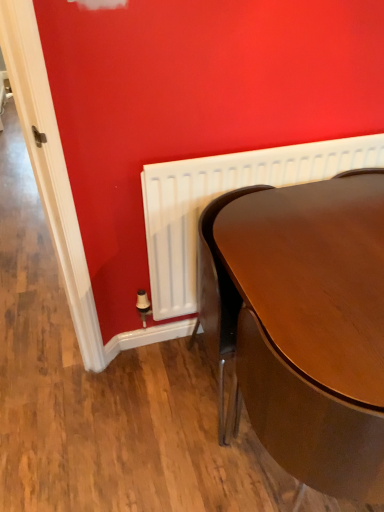
Question: From a real-world perspective, is white plastic radiator at lower left above or below glossy wood table at right?

Choices:
 (A) below
 (B) above

Answer: (B)

Question: Is point (160, 270) closer or farther from the camera than point (314, 426)?

Choices:
 (A) farther
 (B) closer

Answer: (A)

Question: From the image's perspective, is white plastic radiator at lower left located above or below glossy wood table at right?

Choices:
 (A) below
 (B) above

Answer: (B)

Question: Would you say glossy wood table at right is to the left or to the right of white plastic radiator at lower left in the picture?

Choices:
 (A) left
 (B) right

Answer: (B)

Question: Looking at the image, does glossy wood table at right seem bigger or smaller compared to white plastic radiator at lower left?

Choices:
 (A) big
 (B) small

Answer: (A)

Question: From their relative heights in the image, would you say glossy wood table at right is taller or shorter than white plastic radiator at lower left?

Choices:
 (A) short
 (B) tall

Answer: (B)

Question: Choose the correct answer: Is glossy wood table at right inside white plastic radiator at lower left or outside it?

Choices:
 (A) inside
 (B) outside

Answer: (B)